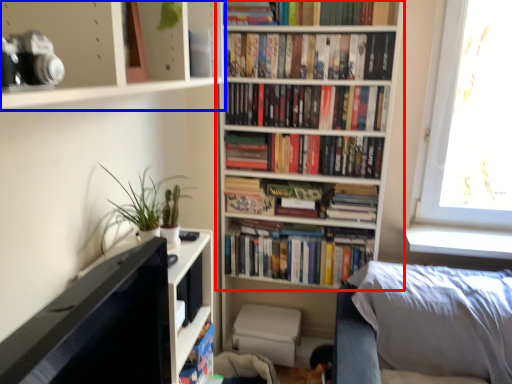
Question: Which object appears closest to the camera in this image, bookcase (highlighted by a red box) or shelf (highlighted by a blue box)?

Choices:
 (A) bookcase
 (B) shelf

Answer: (B)